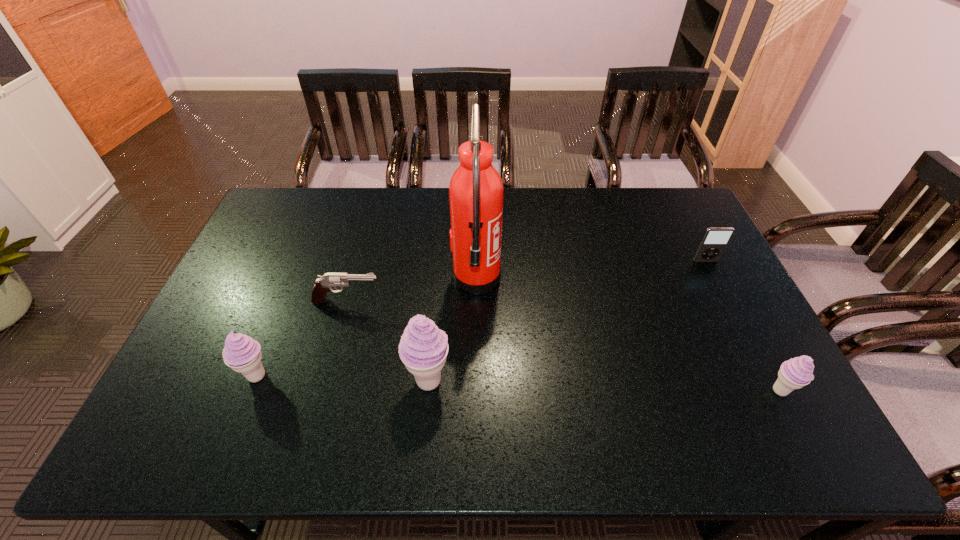
Locate an element on the screen. This screenshot has height=540, width=960. vacant position for inserting another icecream evenly is located at coordinates (603, 386).